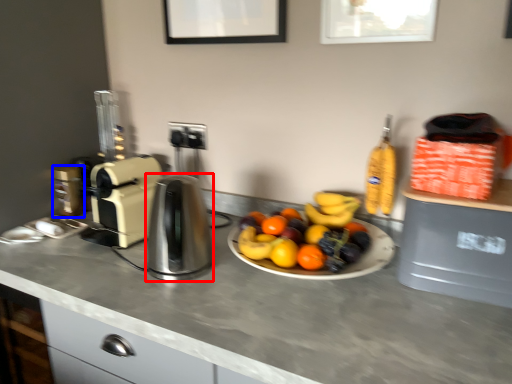
Question: Which of the following is the closest to the observer, kitchen appliance (highlighted by a red box) or coffee machine (highlighted by a blue box)?

Choices:
 (A) kitchen appliance
 (B) coffee machine

Answer: (A)